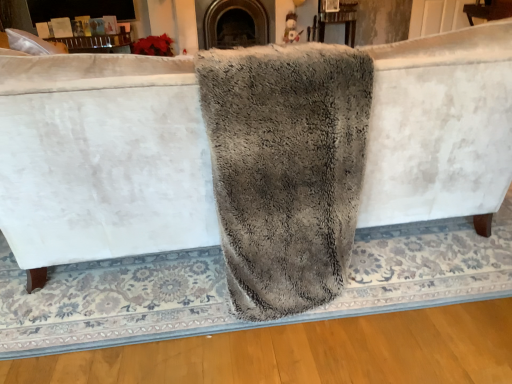
Question: Does dark gray stone fireplace at center appear on the left side of wooden table at upper center?

Choices:
 (A) no
 (B) yes

Answer: (B)

Question: Is dark gray stone fireplace at center to the right of wooden table at upper center from the viewer's perspective?

Choices:
 (A) no
 (B) yes

Answer: (A)

Question: Could you tell me if dark gray stone fireplace at center is facing wooden table at upper center?

Choices:
 (A) yes
 (B) no

Answer: (B)

Question: From the image's perspective, is dark gray stone fireplace at center beneath wooden table at upper center?

Choices:
 (A) no
 (B) yes

Answer: (B)

Question: Is dark gray stone fireplace at center facing away from wooden table at upper center?

Choices:
 (A) no
 (B) yes

Answer: (A)

Question: Is wooden table at upper center located within dark gray stone fireplace at center?

Choices:
 (A) yes
 (B) no

Answer: (B)

Question: Does wooden table at upper center turn towards gray fluffy bath towel at center?

Choices:
 (A) no
 (B) yes

Answer: (B)

Question: Does wooden table at upper center have a greater width compared to gray fluffy bath towel at center?

Choices:
 (A) no
 (B) yes

Answer: (A)

Question: Considering the relative sizes of wooden table at upper center and gray fluffy bath towel at center in the image provided, is wooden table at upper center thinner than gray fluffy bath towel at center?

Choices:
 (A) yes
 (B) no

Answer: (A)

Question: From a real-world perspective, is wooden table at upper center beneath gray fluffy bath towel at center?

Choices:
 (A) yes
 (B) no

Answer: (A)

Question: Is wooden table at upper center taller than gray fluffy bath towel at center?

Choices:
 (A) yes
 (B) no

Answer: (B)

Question: Is wooden table at upper center turned away from gray fluffy bath towel at center?

Choices:
 (A) no
 (B) yes

Answer: (A)

Question: From a real-world perspective, is gray fluffy bath towel at center physically above wooden table at upper center?

Choices:
 (A) no
 (B) yes

Answer: (B)